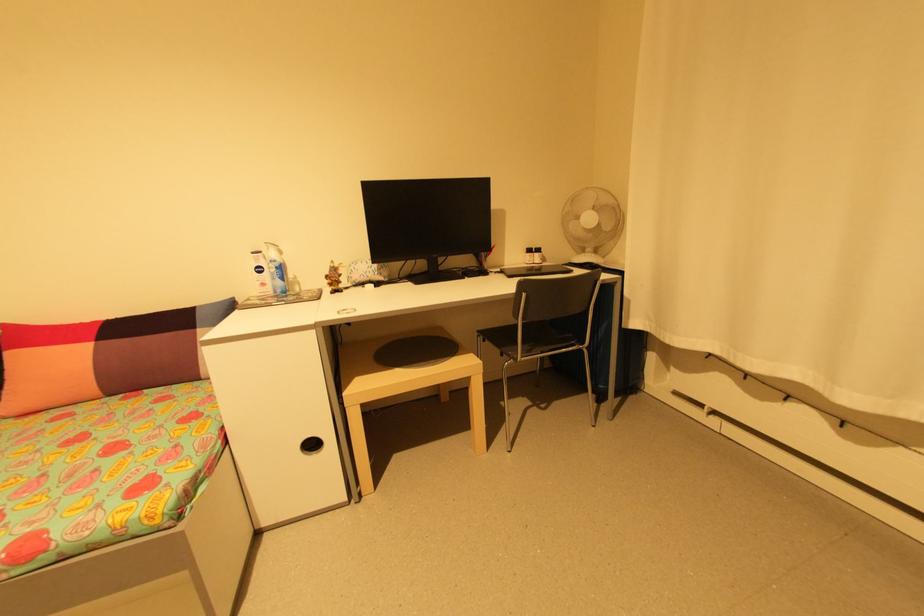
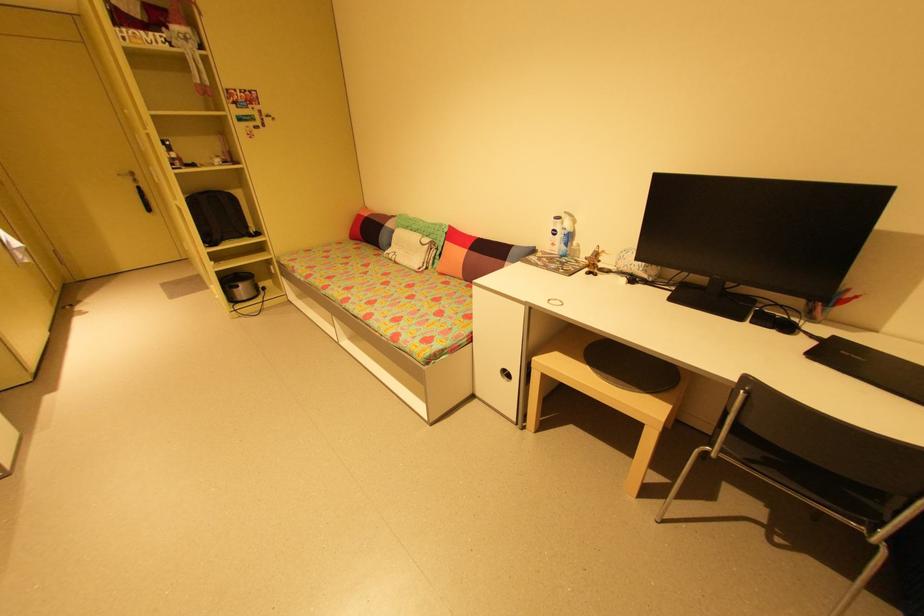
Locate, in the second image, the point that corresponds to (286,269) in the first image.

(574, 237)